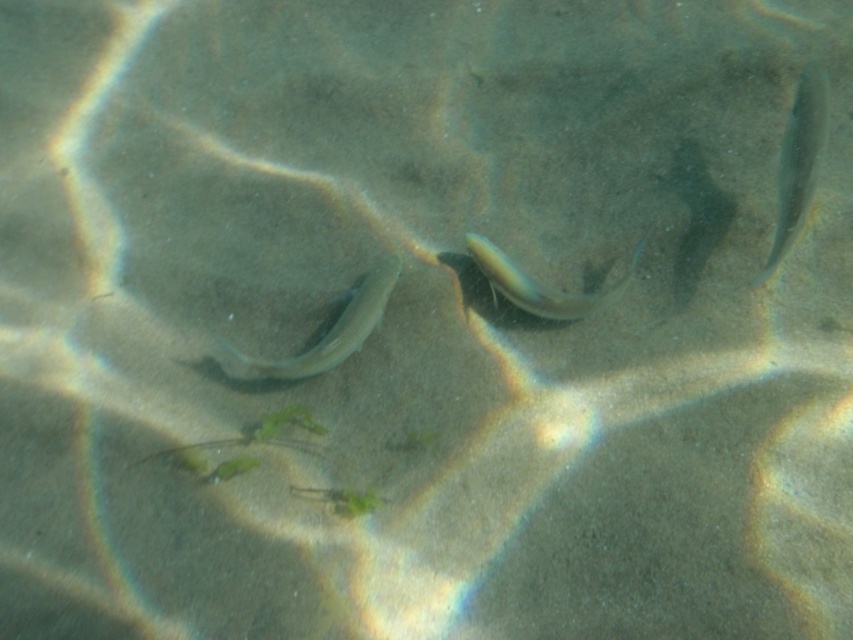
Can you confirm if translucent greenish fish at center is thinner than translucent rubber fish at center?

In fact, translucent greenish fish at center might be wider than translucent rubber fish at center.

Is translucent greenish fish at center further to the viewer compared to translucent rubber fish at center?

No, it is not.

The height and width of the screenshot is (640, 853). What do you see at coordinates (328, 330) in the screenshot?
I see `translucent greenish fish at center` at bounding box center [328, 330].

Where is `translucent greenish fish at center`? translucent greenish fish at center is located at coordinates (328, 330).

Describe the element at coordinates (798, 161) in the screenshot. I see `shiny silver fish at upper right` at that location.

Is shiny silver fish at upper right in front of translucent greenish fish at center?

Yes, shiny silver fish at upper right is in front of translucent greenish fish at center.

Between point (787, 244) and point (335, 317), which one is positioned in front?

Positioned in front is point (787, 244).

The width and height of the screenshot is (853, 640). In order to click on shiny silver fish at upper right in this screenshot , I will do `click(798, 161)`.

Who is positioned more to the left, shiny silver fish at upper right or translucent rubber fish at center?

translucent rubber fish at center is more to the left.

Between shiny silver fish at upper right and translucent rubber fish at center, which one has less height?

With less height is translucent rubber fish at center.

The height and width of the screenshot is (640, 853). Identify the location of shiny silver fish at upper right. (798, 161).